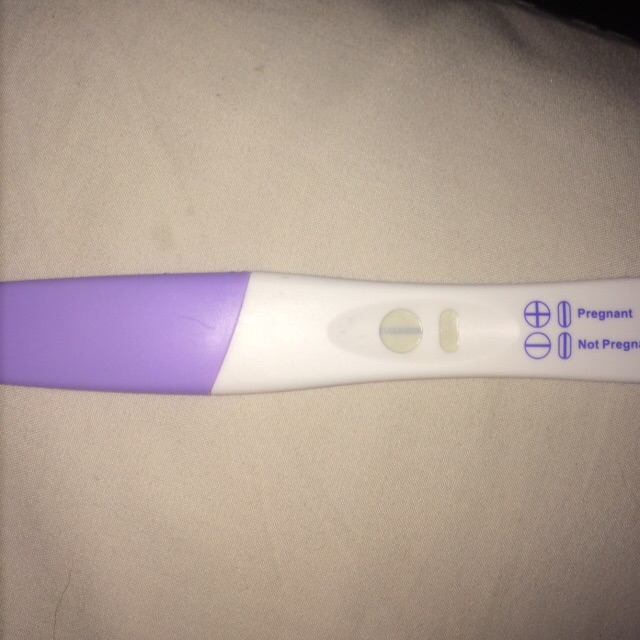
The image size is (640, 640). Find the location of `countertop below pregnancy test`. countertop below pregnancy test is located at coordinates (331, 422).